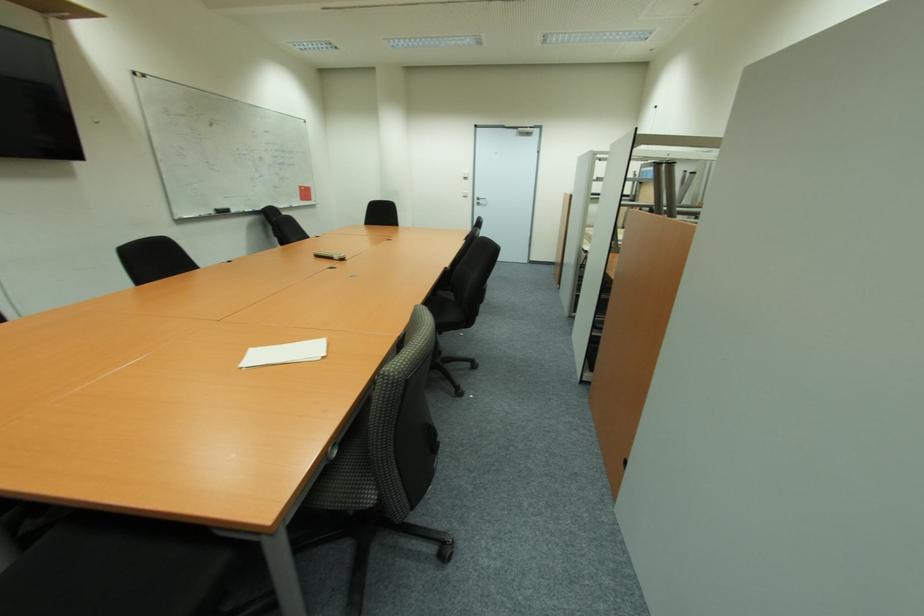
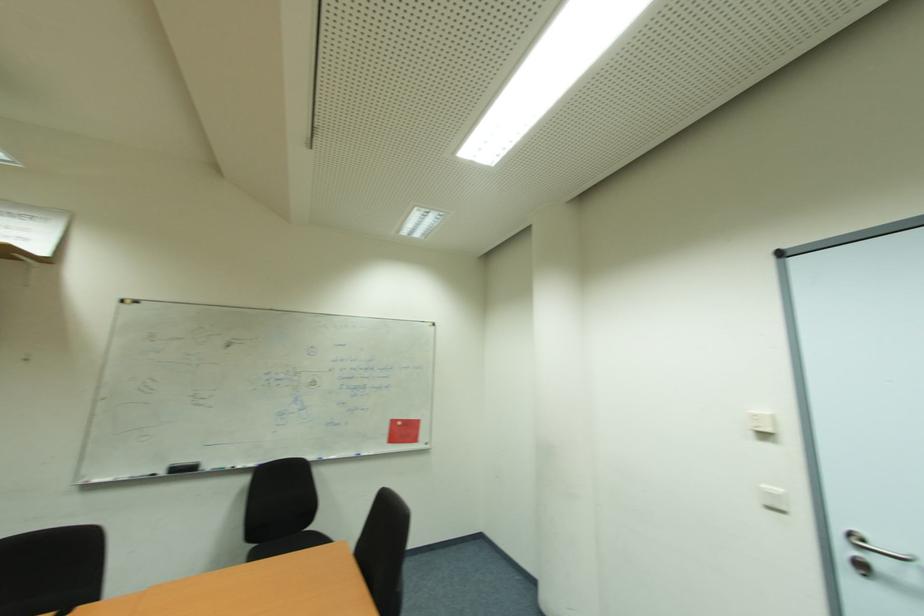
In the second image, find the point that corresponds to [469,192] in the first image.

(784, 492)